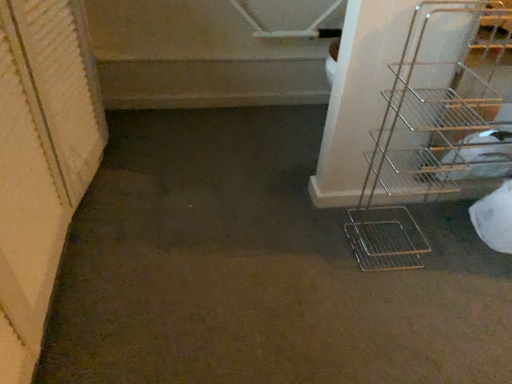
Locate an element on the screen. This screenshot has height=384, width=512. smooth concrete stairs at upper left is located at coordinates (212, 83).

In order to face smooth concrete stairs at upper left, should I rotate leftwards or rightwards?

A 8.979 degree turn to the left will do.

The height and width of the screenshot is (384, 512). What do you see at coordinates (212, 83) in the screenshot? I see `smooth concrete stairs at upper left` at bounding box center [212, 83].

Locate an element on the screen. metallic wire rack at right is located at coordinates (433, 125).

The width and height of the screenshot is (512, 384). What do you see at coordinates (433, 125) in the screenshot?
I see `metallic wire rack at right` at bounding box center [433, 125].

Find the location of a particular element. smooth concrete stairs at upper left is located at coordinates (212, 83).

Considering the relative positions of smooth concrete stairs at upper left and metallic wire rack at right in the image provided, is smooth concrete stairs at upper left to the left of metallic wire rack at right from the viewer's perspective?

Yes, smooth concrete stairs at upper left is to the left of metallic wire rack at right.

Does smooth concrete stairs at upper left lie in front of metallic wire rack at right?

That is False.

Based on the photo, which is more distant, (278, 72) or (432, 106)?

Point (278, 72)

Looking at this image, from the image's perspective, between smooth concrete stairs at upper left and metallic wire rack at right, which one is located above?

From the image's view, smooth concrete stairs at upper left is above.

From a real-world perspective, does smooth concrete stairs at upper left stand above metallic wire rack at right?

No, from a real-world perspective, smooth concrete stairs at upper left is not on top of metallic wire rack at right.

Considering the sizes of objects smooth concrete stairs at upper left and metallic wire rack at right in the image provided, who is thinner, smooth concrete stairs at upper left or metallic wire rack at right?

Thinner between the two is metallic wire rack at right.

Who is shorter, smooth concrete stairs at upper left or metallic wire rack at right?

smooth concrete stairs at upper left.

Between smooth concrete stairs at upper left and metallic wire rack at right, which one has smaller size?

metallic wire rack at right.

Is smooth concrete stairs at upper left inside the boundaries of metallic wire rack at right, or outside?

smooth concrete stairs at upper left cannot be found inside metallic wire rack at right.

Is smooth concrete stairs at upper left not near metallic wire rack at right?

They are positioned close to each other.

Is metallic wire rack at right at the back of smooth concrete stairs at upper left?

That's not correct — smooth concrete stairs at upper left is not looking away from metallic wire rack at right.

In the scene shown: How many degrees apart are the facing directions of smooth concrete stairs at upper left and metallic wire rack at right?

90.1 degrees separate the facing orientations of smooth concrete stairs at upper left and metallic wire rack at right.

Measure the distance between smooth concrete stairs at upper left and metallic wire rack at right.

smooth concrete stairs at upper left and metallic wire rack at right are 36.03 inches apart from each other.

The image size is (512, 384). I want to click on shelf below the smooth concrete stairs at upper left (from the image's perspective), so click(433, 125).

Does metallic wire rack at right appear on the right side of smooth concrete stairs at upper left?

Correct, you'll find metallic wire rack at right to the right of smooth concrete stairs at upper left.

Based on the photo, is metallic wire rack at right closer to the viewer compared to smooth concrete stairs at upper left?

Yes, it is in front of smooth concrete stairs at upper left.

Which is less distant, (423, 39) or (227, 70)?

Point (423, 39) is closer to the camera than point (227, 70).

From the image's perspective, between metallic wire rack at right and smooth concrete stairs at upper left, who is located below?

metallic wire rack at right.

From a real-world perspective, is metallic wire rack at right above or below smooth concrete stairs at upper left?

In terms of real-world spatial position, metallic wire rack at right is above smooth concrete stairs at upper left.

Which of these two, metallic wire rack at right or smooth concrete stairs at upper left, is wider?

smooth concrete stairs at upper left is wider.

From their relative heights in the image, would you say metallic wire rack at right is taller or shorter than smooth concrete stairs at upper left?

Clearly, metallic wire rack at right is taller compared to smooth concrete stairs at upper left.

Between metallic wire rack at right and smooth concrete stairs at upper left, which one has smaller size?

Smaller between the two is metallic wire rack at right.

Would you say metallic wire rack at right is inside or outside smooth concrete stairs at upper left?

The correct answer is: outside.

Is there a large distance between metallic wire rack at right and smooth concrete stairs at upper left?

No, there isn't a large distance between metallic wire rack at right and smooth concrete stairs at upper left.

Could you tell me if metallic wire rack at right is facing smooth concrete stairs at upper left?

No, metallic wire rack at right is not turned towards smooth concrete stairs at upper left.

What's the angular difference between metallic wire rack at right and smooth concrete stairs at upper left's facing directions?

90.1 degrees separate the facing orientations of metallic wire rack at right and smooth concrete stairs at upper left.

At what (x,y) coordinates should I click in order to perform the action: click on stairs located above the metallic wire rack at right (from the image's perspective). Please return your answer as a coordinate pair (x, y). This screenshot has width=512, height=384. Looking at the image, I should click on (212, 83).

You are a GUI agent. You are given a task and a screenshot of the screen. Output one action in this format:
    pyautogui.click(x=<x>, y=<y>)
    Task: Click on the shelf lying below the smooth concrete stairs at upper left (from the image's perspective)
    This screenshot has width=512, height=384.
    Given the screenshot: What is the action you would take?
    pyautogui.click(x=433, y=125)

Where is `shelf in front of the smooth concrete stairs at upper left`? shelf in front of the smooth concrete stairs at upper left is located at coordinates (433, 125).